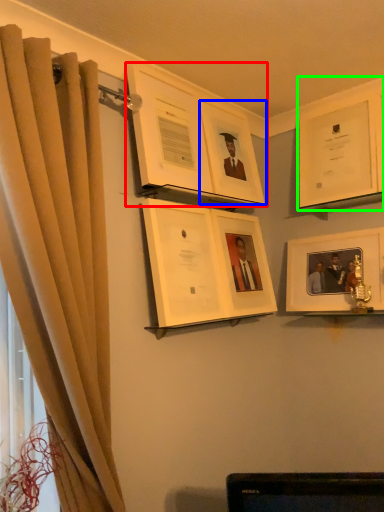
Question: Considering the real-world distances, which object is closest to picture frame (highlighted by a red box)? picture frame (highlighted by a blue box) or picture frame (highlighted by a green box).

Choices:
 (A) picture frame
 (B) picture frame

Answer: (A)